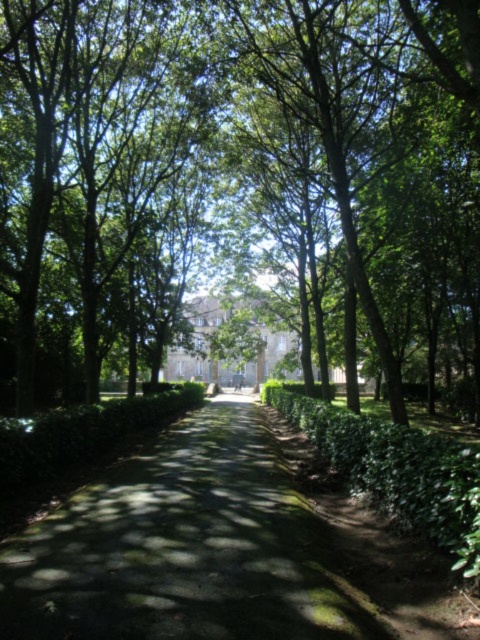
Can you confirm if green leafy tree at center is bigger than green mossy path at center?

Yes.

You are a GUI agent. You are given a task and a screenshot of the screen. Output one action in this format:
    pyautogui.click(x=<x>, y=<y>)
    Task: Click on the green leafy tree at center
    This screenshot has height=640, width=480.
    Given the screenshot: What is the action you would take?
    pyautogui.click(x=239, y=177)

Who is positioned more to the left, green mossy path at center or green leafy hedge at center?

Positioned to the left is green mossy path at center.

Is point (331, 500) behind point (372, 448)?

Yes.

The image size is (480, 640). What are the coordinates of `green mossy path at center` in the screenshot? It's located at (219, 548).

Who is more distant from viewer, [289,61] or [372,476]?

The point [289,61] is more distant.

Can you confirm if green leafy tree at center is positioned to the right of green leafy hedge at center?

In fact, green leafy tree at center is to the left of green leafy hedge at center.

What do you see at coordinates (239, 177) in the screenshot?
I see `green leafy tree at center` at bounding box center [239, 177].

Where is `green leafy tree at center`? The height and width of the screenshot is (640, 480). green leafy tree at center is located at coordinates point(239,177).